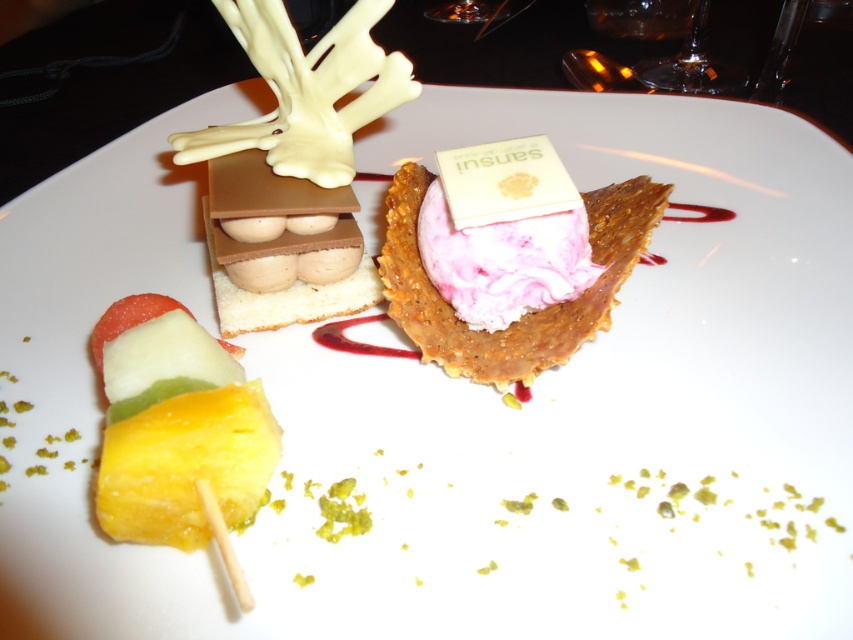
Between multicolored fruit skewer at center and pink creamy ice cream at center, which one has less height?

Standing shorter between the two is multicolored fruit skewer at center.

In the scene shown: Is multicolored fruit skewer at center further to camera compared to pink creamy ice cream at center?

No, it is not.

The width and height of the screenshot is (853, 640). I want to click on multicolored fruit skewer at center, so click(175, 426).